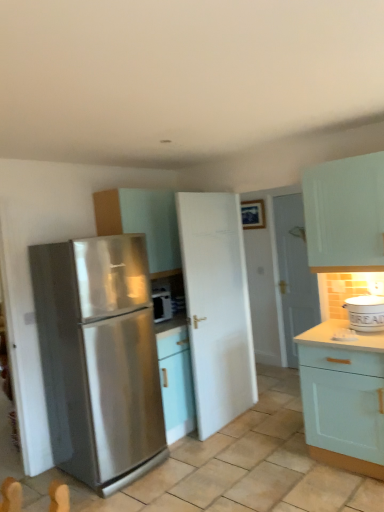
Question: Should I look upward or downward to see white glossy door at center, which is the second door from front to back?

Choices:
 (A) down
 (B) up

Answer: (A)

Question: Can you confirm if matte white cabinet at center, acting as the first cabinetry starting from the left, is wider than stainless steel refrigerator at left?

Choices:
 (A) yes
 (B) no

Answer: (B)

Question: Is matte white cabinet at center, arranged as the second cabinetry when ordered from the bottom, closer to camera compared to stainless steel refrigerator at left?

Choices:
 (A) no
 (B) yes

Answer: (A)

Question: Is matte white cabinet at center, acting as the second cabinetry starting from the right, at the right side of stainless steel refrigerator at left?

Choices:
 (A) no
 (B) yes

Answer: (B)

Question: Can you confirm if matte white cabinet at center, acting as the first cabinetry starting from the left, is smaller than stainless steel refrigerator at left?

Choices:
 (A) no
 (B) yes

Answer: (B)

Question: Is matte white cabinet at center, arranged as the second cabinetry when viewed from the front, thinner than stainless steel refrigerator at left?

Choices:
 (A) no
 (B) yes

Answer: (B)

Question: Is matte white cabinet at center, arranged as the second cabinetry when viewed from the front, further to camera compared to stainless steel refrigerator at left?

Choices:
 (A) no
 (B) yes

Answer: (B)

Question: Considering the relative positions of stainless steel refrigerator at left and white ceramic bucket at right, which is the first appliance from front to back, in the image provided, is stainless steel refrigerator at left to the left of white ceramic bucket at right, which is the first appliance from front to back, from the viewer's perspective?

Choices:
 (A) yes
 (B) no

Answer: (A)

Question: Is stainless steel refrigerator at left at the right side of white ceramic bucket at right, which is counted as the 2th appliance, starting from the left?

Choices:
 (A) no
 (B) yes

Answer: (A)

Question: Does stainless steel refrigerator at left lie in front of white ceramic bucket at right, which is the 1th appliance from right to left?

Choices:
 (A) no
 (B) yes

Answer: (B)

Question: From the image's perspective, is stainless steel refrigerator at left under white ceramic bucket at right, which is the first appliance from front to back?

Choices:
 (A) yes
 (B) no

Answer: (A)

Question: Does stainless steel refrigerator at left have a greater width compared to white ceramic bucket at right, which is the 1th appliance from right to left?

Choices:
 (A) no
 (B) yes

Answer: (B)

Question: From the image's perspective, is stainless steel refrigerator at left located above white ceramic bucket at right, which is the first appliance from front to back?

Choices:
 (A) no
 (B) yes

Answer: (A)

Question: Does matte white cabinet at center, acting as the second cabinetry starting from the right, turn towards white glossy door at center, the 1th door positioned from the back?

Choices:
 (A) yes
 (B) no

Answer: (B)